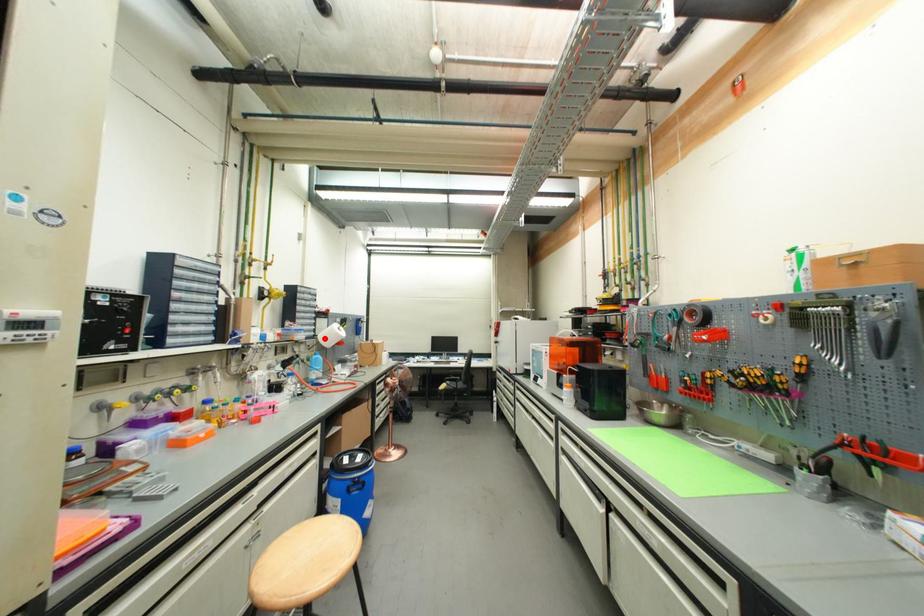
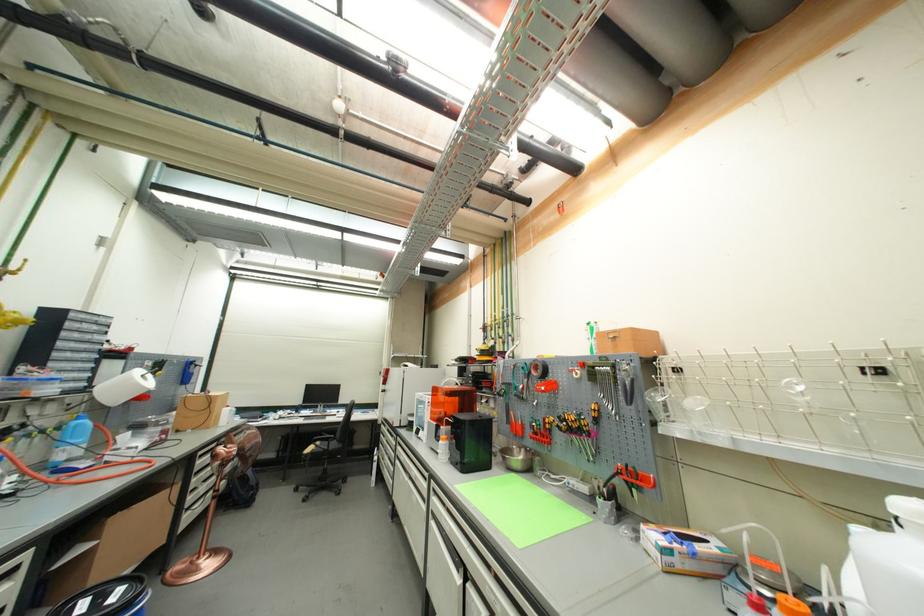
The point at the highlighted location is marked in the first image. Where is the corresponding point in the second image?

(103, 391)